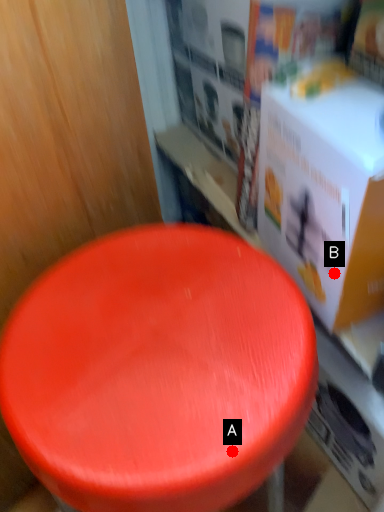
Question: Two points are circled on the image, labeled by A and B beside each circle. Which point is closer to the camera taking this photo?

Choices:
 (A) A is closer
 (B) B is closer

Answer: (A)